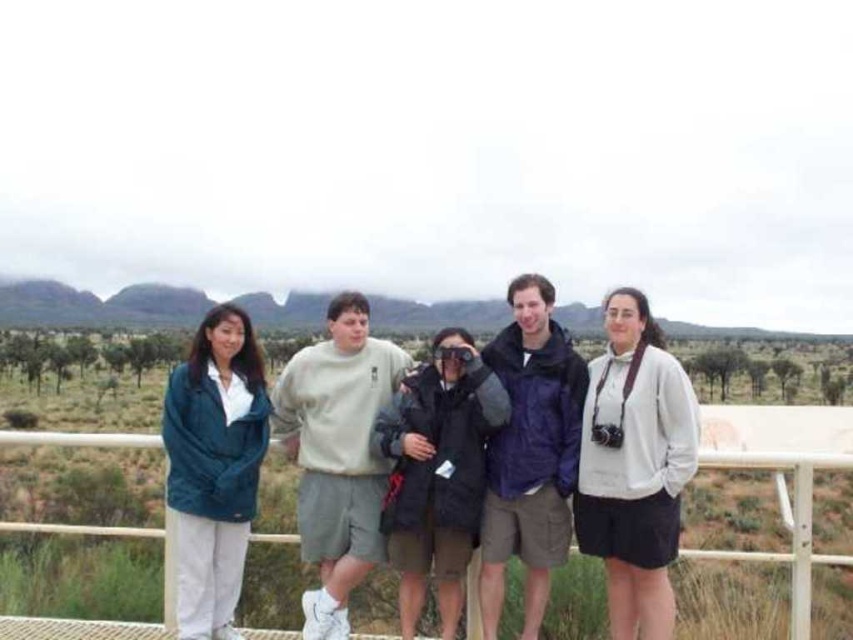
Is point (213, 371) closer to camera compared to point (782, 451)?

Yes, point (213, 371) is closer to viewer.

Does point (252, 493) lie in front of point (131, 531)?

No, it is not.

You are a GUI agent. You are given a task and a screenshot of the screen. Output one action in this format:
    pyautogui.click(x=<x>, y=<y>)
    Task: Click on the teal fleece jacket at left
    
    Given the screenshot: What is the action you would take?
    pyautogui.click(x=213, y=467)

Image resolution: width=853 pixels, height=640 pixels. Describe the element at coordinates (635, 467) in the screenshot. I see `white matte jacket at center` at that location.

Between white matte jacket at center and metallic white fence at center, which one is positioned higher?

white matte jacket at center

The image size is (853, 640). Find the location of `white matte jacket at center`. white matte jacket at center is located at coordinates (635, 467).

Can you confirm if white matte jacket at center is taller than teal fleece jacket at left?

Yes.

Where is `white matte jacket at center`? white matte jacket at center is located at coordinates (635, 467).